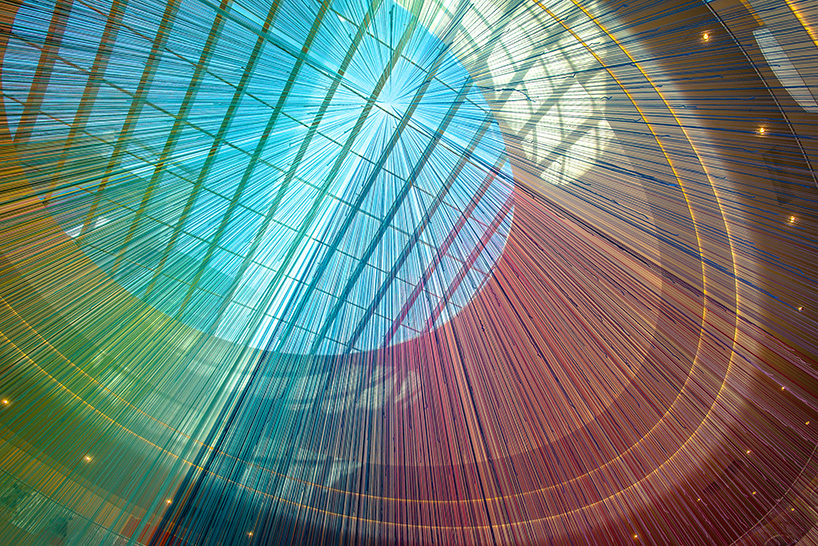
The image size is (818, 546). I want to click on window, so click(433, 234).